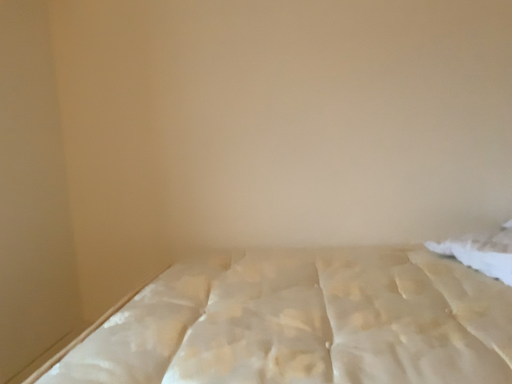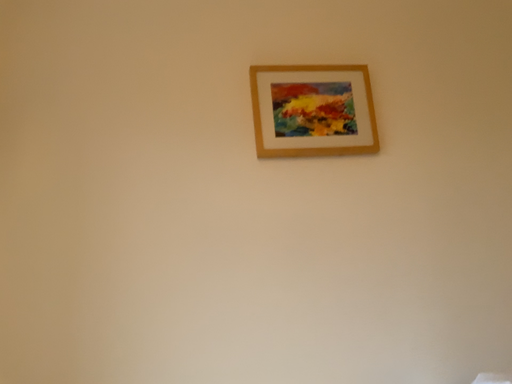
Question: Which way did the camera rotate in the video?

Choices:
 (A) rotated downward
 (B) rotated upward

Answer: (B)